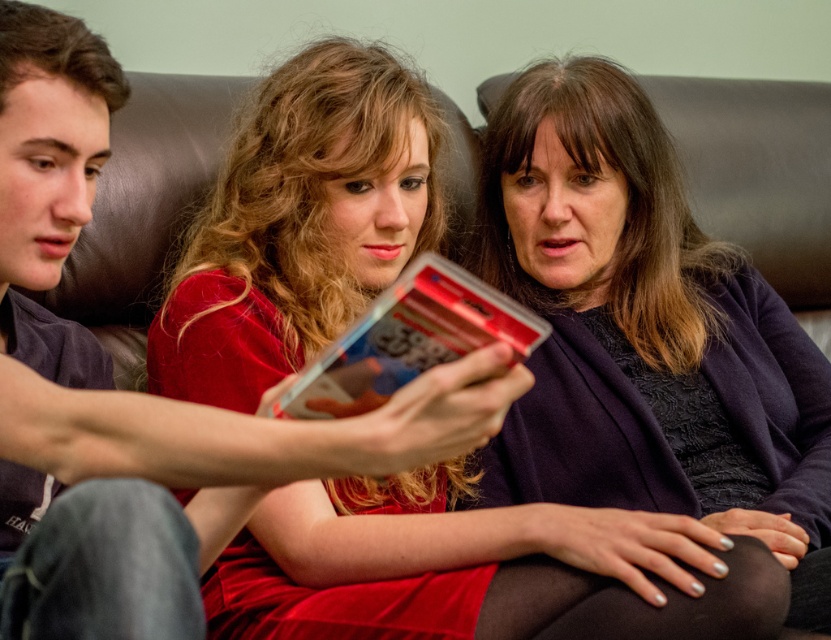
Who is shorter, matte black sweater at center or matte black shirt at left?

With less height is matte black shirt at left.

You are a GUI agent. You are given a task and a screenshot of the screen. Output one action in this format:
    pyautogui.click(x=<x>, y=<y>)
    Task: Click on the matte black sweater at center
    The width and height of the screenshot is (831, 640).
    Given the screenshot: What is the action you would take?
    pyautogui.click(x=645, y=333)

Is point (746, 292) positioned behind point (374, 420)?

That is True.

The height and width of the screenshot is (640, 831). I want to click on matte black sweater at center, so click(x=645, y=333).

Between velvet red dress at center and matte black sweater at center, which one appears on the right side from the viewer's perspective?

matte black sweater at center

Is point (273, 81) positioned after point (595, 339)?

No, it is in front of (595, 339).

Image resolution: width=831 pixels, height=640 pixels. Identify the location of velvet red dress at center. (478, 568).

In the scene shown: Can you confirm if matte black sweater at center is smaller than shiny plastic card at center?

Incorrect, matte black sweater at center is not smaller in size than shiny plastic card at center.

Which is below, matte black sweater at center or shiny plastic card at center?

shiny plastic card at center is below.

Is point (758, 368) positioned after point (377, 321)?

Yes, it is.

Where is `matte black sweater at center`? The image size is (831, 640). matte black sweater at center is located at coordinates (645, 333).